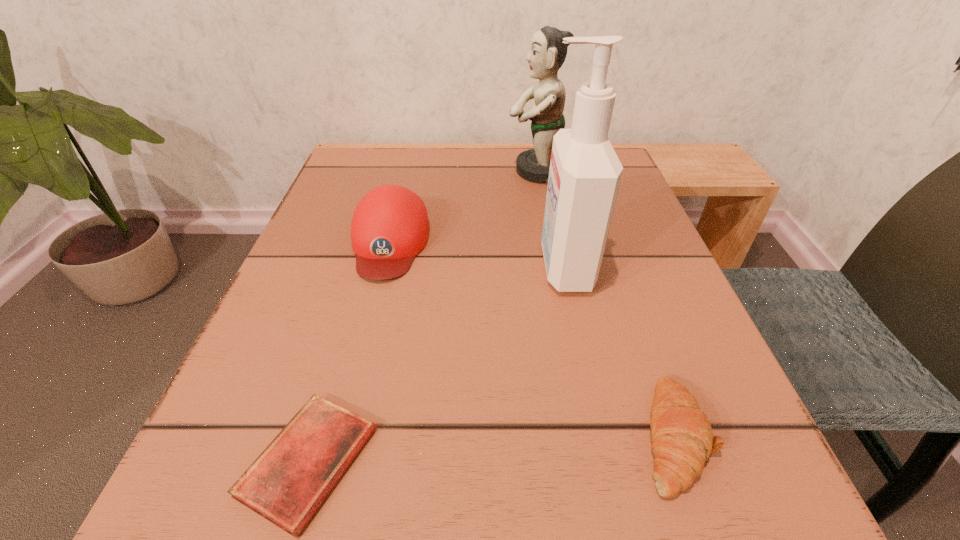
Image resolution: width=960 pixels, height=540 pixels. Find the location of `free space that is in between the fourth shortest object and the crescent roll`. free space that is in between the fourth shortest object and the crescent roll is located at coordinates (607, 303).

Locate which object ranks fourth in proximity to the tallest object. Please provide its 2D coordinates. Your answer should be formatted as a tuple, i.e. [(x, y)], where the tuple contains the x and y coordinates of a point satisfying the conditions above.

[(287, 483)]

This screenshot has height=540, width=960. I want to click on object that is the third nearest to the shortest object, so click(x=682, y=438).

In order to click on free space that satisfies the following two spatial constraints: 1. on the front-facing side of the farthest object; 2. on the front-facing side of the third tallest object in this screenshot , I will do `click(553, 242)`.

At what (x,y) coordinates should I click in order to perform the action: click on blank area in the image that satisfies the following two spatial constraints: 1. on the back side of the crescent roll; 2. on the front-facing side of the farthest object. Please return your answer as a coordinate pair (x, y). Looking at the image, I should click on (582, 171).

Locate an element on the screen. This screenshot has width=960, height=540. free location that satisfies the following two spatial constraints: 1. on the front-facing side of the farthest object; 2. on the front-facing side of the baseball cap is located at coordinates (553, 242).